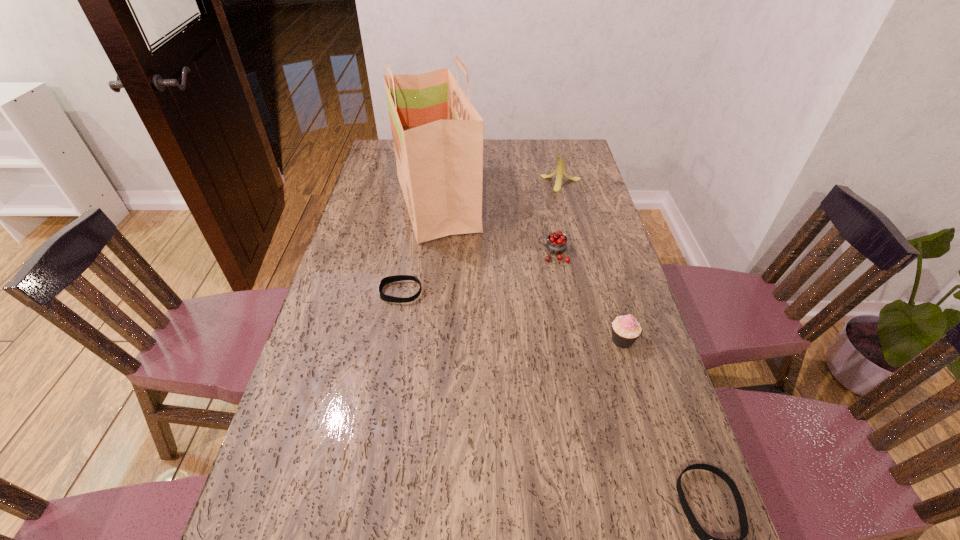
Locate an element on the screen. The image size is (960, 540). object that is the third closest one to the second shortest object is located at coordinates (390, 279).

You are a GUI agent. You are given a task and a screenshot of the screen. Output one action in this format:
    pyautogui.click(x=<x>, y=<y>)
    Task: Click on the object that is the fifth closest to the cherry
    This screenshot has height=540, width=960.
    Given the screenshot: What is the action you would take?
    pyautogui.click(x=705, y=539)

Identify the location of free space that satisfies the following two spatial constraints: 1. on the display of the fifth farthest object; 2. on the right side of the fourth farthest object. The image size is (960, 540). (392, 340).

At what (x,y) coordinates should I click in order to perform the action: click on free space that satisfies the following two spatial constraints: 1. on the handle side of the cherry; 2. on the right side of the second tallest object. Please return your answer as a coordinate pair (x, y). The height and width of the screenshot is (540, 960). Looking at the image, I should click on (540, 184).

Locate an element on the screen. The width and height of the screenshot is (960, 540). vacant space that satisfies the following two spatial constraints: 1. on the handle side of the cherry; 2. on the left side of the second tallest object is located at coordinates 540,184.